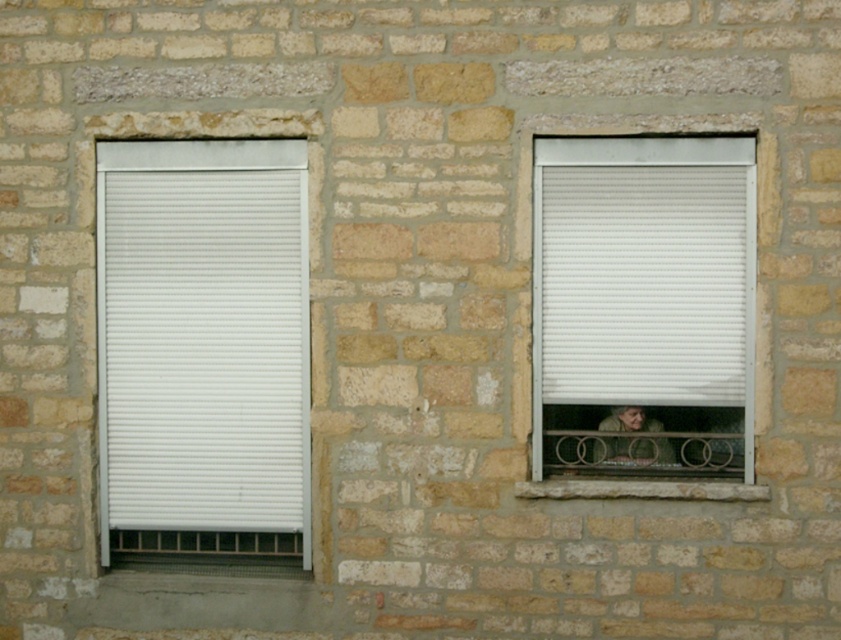
Is point (193, 483) closer to viewer compared to point (644, 456)?

No, it is behind (644, 456).

This screenshot has height=640, width=841. Identify the location of white matte blind at left. (204, 349).

Locate an element on the screen. white plastic window at right is located at coordinates (643, 317).

From the picture: Is white plastic window at right shorter than white matte blind at left?

Yes.

Is point (559, 323) farther from viewer compared to point (266, 449)?

No, it is not.

Find the location of a particular element. white plastic window at right is located at coordinates (643, 317).

Does white plastic window at right have a smaller size compared to light brown leather jacket at lower right?

Actually, white plastic window at right might be larger than light brown leather jacket at lower right.

Which is behind, point (548, 472) or point (617, 406)?

Positioned behind is point (548, 472).

Where is `white plastic window at right`? The height and width of the screenshot is (640, 841). white plastic window at right is located at coordinates (643, 317).